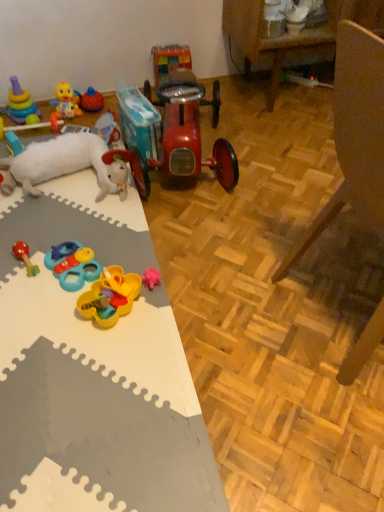
Question: From the image's perspective, is yellow rubber duck at upper left, the third toy in the left-to-right sequence, beneath yellow plastic toy at center, arranged as the 3th toy when viewed from the right?

Choices:
 (A) no
 (B) yes

Answer: (A)

Question: Is yellow rubber duck at upper left, the 9th toy viewed from the right, positioned with its back to yellow plastic toy at center, arranged as the 3th toy when viewed from the right?

Choices:
 (A) no
 (B) yes

Answer: (A)

Question: Is there a large distance between yellow rubber duck at upper left, the third toy in the left-to-right sequence, and yellow plastic toy at center, positioned as the 9th toy in left-to-right order?

Choices:
 (A) yes
 (B) no

Answer: (B)

Question: Is yellow rubber duck at upper left, the 9th toy viewed from the right, next to yellow plastic toy at center, positioned as the 9th toy in left-to-right order, and touching it?

Choices:
 (A) yes
 (B) no

Answer: (B)

Question: From the image's perspective, is yellow rubber duck at upper left, the 9th toy viewed from the right, above yellow plastic toy at center, positioned as the 9th toy in left-to-right order?

Choices:
 (A) no
 (B) yes

Answer: (B)

Question: Is yellow rubber duck at upper left, the third toy in the left-to-right sequence, wider than yellow plastic toy at center, positioned as the 9th toy in left-to-right order?

Choices:
 (A) no
 (B) yes

Answer: (A)

Question: Is white plush sheep at left, which appears as the 5th toy when viewed from the left, wider than wooden armchair at lower right?

Choices:
 (A) yes
 (B) no

Answer: (B)

Question: Would you consider white plush sheep at left, which ranks as the 7th toy in right-to-left order, to be distant from wooden armchair at lower right?

Choices:
 (A) yes
 (B) no

Answer: (B)

Question: Is the position of white plush sheep at left, which appears as the 5th toy when viewed from the left, less distant than that of wooden armchair at lower right?

Choices:
 (A) yes
 (B) no

Answer: (B)

Question: Can you confirm if white plush sheep at left, which appears as the 5th toy when viewed from the left, is positioned to the left of wooden armchair at lower right?

Choices:
 (A) no
 (B) yes

Answer: (B)

Question: Is white plush sheep at left, which ranks as the 7th toy in right-to-left order, facing away from wooden armchair at lower right?

Choices:
 (A) yes
 (B) no

Answer: (B)

Question: Is white plush sheep at left, which appears as the 5th toy when viewed from the left, bigger than wooden armchair at lower right?

Choices:
 (A) yes
 (B) no

Answer: (B)

Question: Is plastic/soft yellow and blue toy at lower left, the 4th toy viewed from the right, smaller than multicolored plastic toy at center, which is the 2th toy from right to left?

Choices:
 (A) no
 (B) yes

Answer: (B)